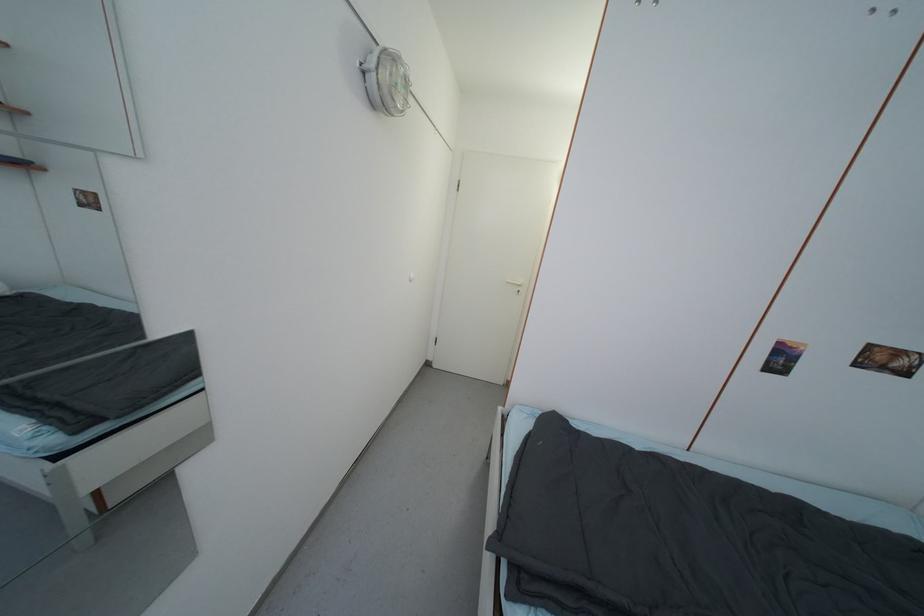
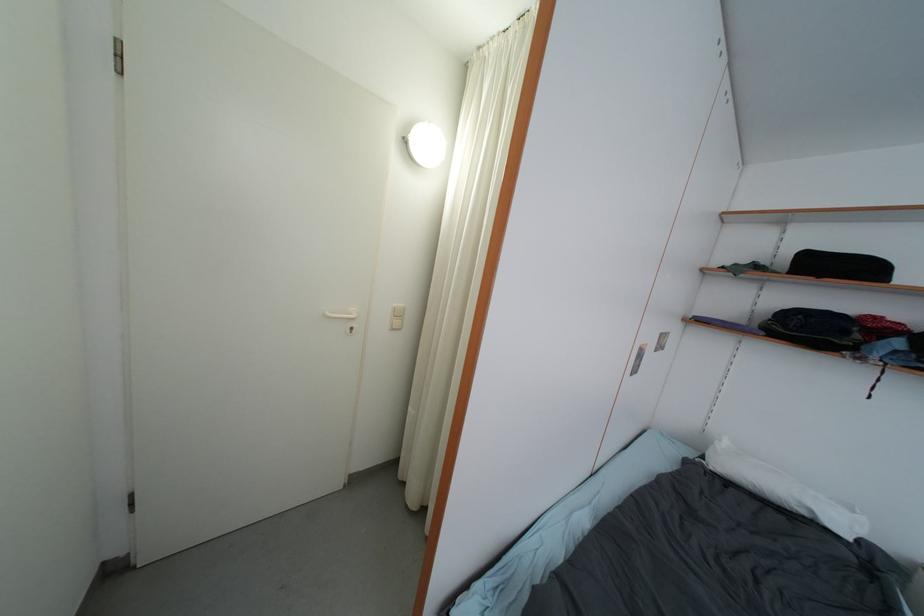
Question: Based on the continuous images, in which direction is the camera rotating? Reply with the corresponding letter.

Choices:
 (A) Left
 (B) Right
 (C) Up
 (D) Down

Answer: (B)